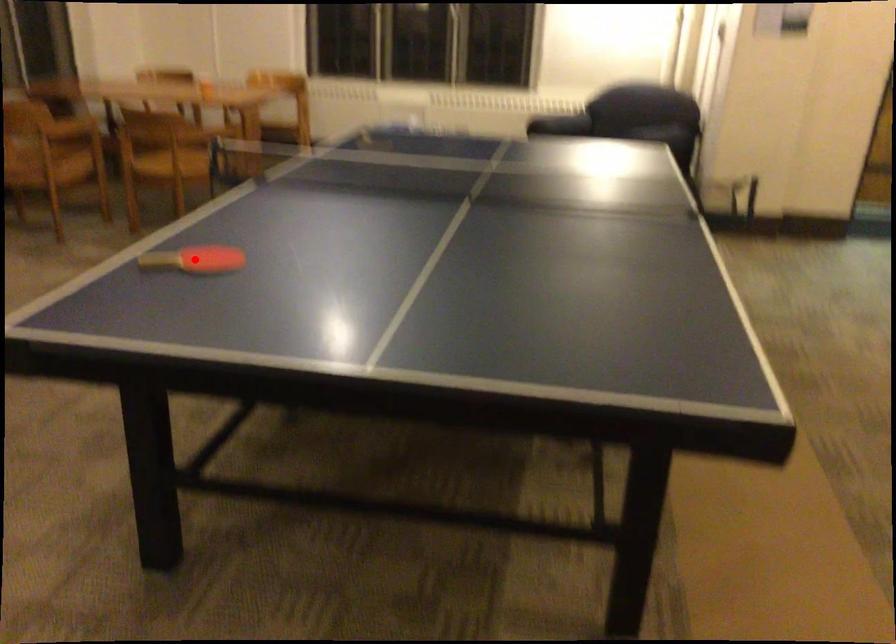
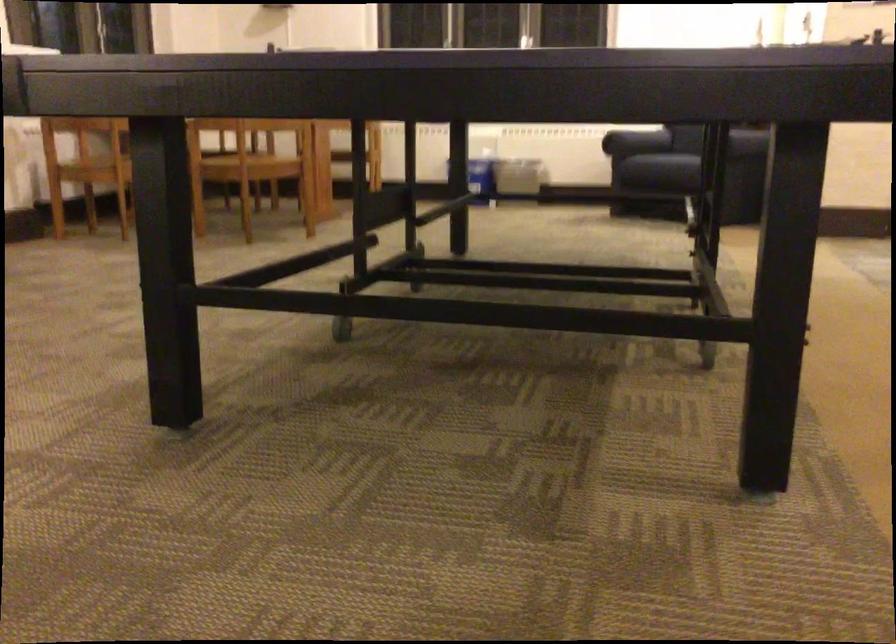
Question: I am providing you with two images of the same scene from different viewpoints. A red point is marked on the first image. At the location where the point appears in image 1, is it still visible in image 2?

Choices:
 (A) Yes
 (B) No

Answer: (B)